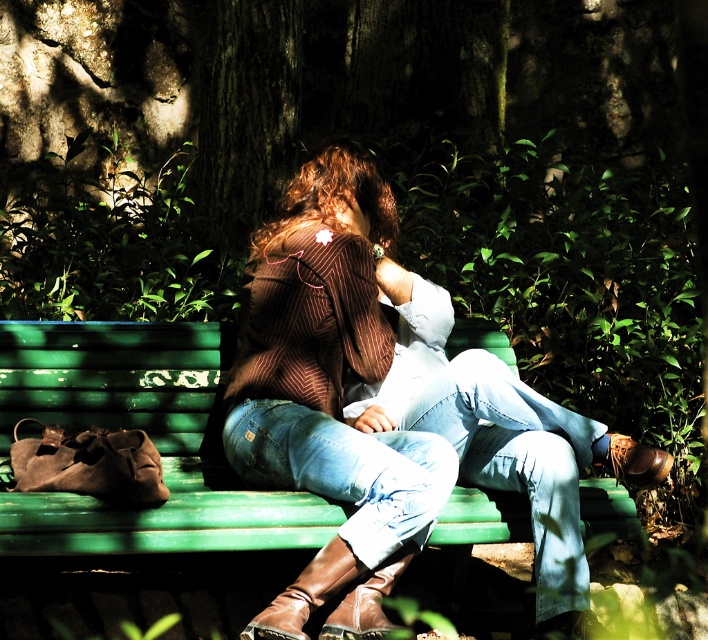
From the picture: You are a photographer planning to take a portrait of the two people sitting on the green painted wood bench at center. You notice the brown striped sweater at center is covering part of the bench. Will the sweater be visible in the photo if you focus on the people?

The brown striped sweater at center is located above the green painted wood bench at center, so it will be visible in the photo when focusing on the people.

You are an artist trying to sketch this scene. You need to decide the order to draw the objects so that taller objects are drawn first to ensure proper layering. Which object should you draw first between the brown striped sweater at center and the green painted wood bench at center?

The brown striped sweater at center is taller than the green painted wood bench at center, so you should draw the brown striped sweater at center first to ensure proper layering.

You are a photographer standing in front of the green painted wood bench at center. You want to take a photo of the brown striped sweater at center without it being too close to the bench. Can you move the sweater further away from the bench so that there is at least 20 inches between them?

The brown striped sweater at center is currently 17.35 inches from the green painted wood bench at center. To achieve the desired 20 inches, you need to move the sweater approximately 2.65 inches away from the bench.